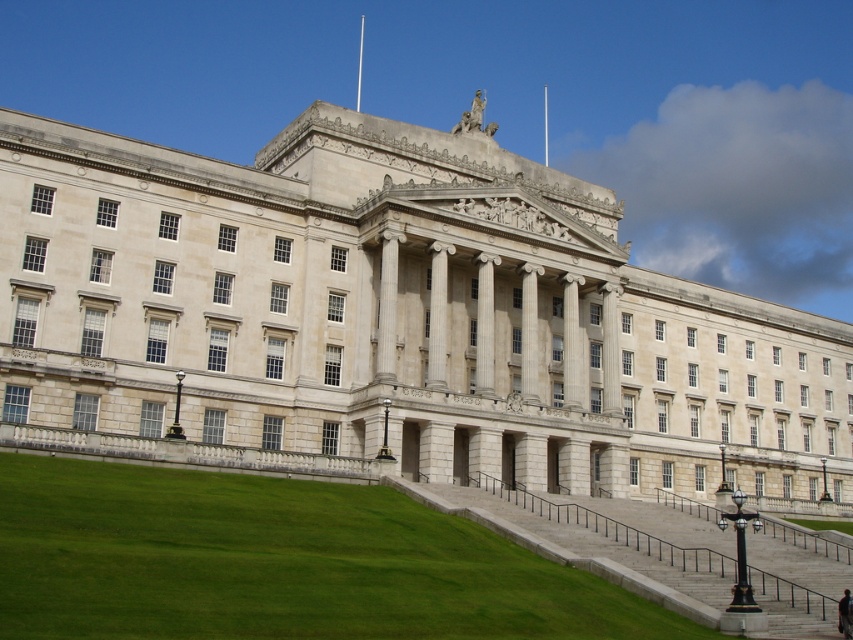
Question: Is white stone building at center to the right of green grass at lower left from the viewer's perspective?

Choices:
 (A) yes
 (B) no

Answer: (A)

Question: Which of the following is the farthest from the observer?

Choices:
 (A) (187, 557)
 (B) (715, 426)

Answer: (B)

Question: Which point is closer to the camera?

Choices:
 (A) green grass at lower left
 (B) white stone building at center

Answer: (A)

Question: Can you confirm if white stone building at center is smaller than green grass at lower left?

Choices:
 (A) yes
 (B) no

Answer: (B)

Question: Is white stone building at center thinner than green grass at lower left?

Choices:
 (A) no
 (B) yes

Answer: (A)